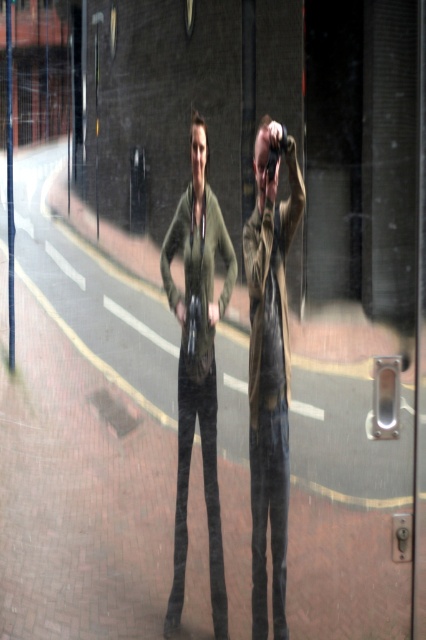
Question: Is leather jacket at center positioned at the back of olive green fabric jacket at center?

Choices:
 (A) no
 (B) yes

Answer: (B)

Question: Which point is farther from the camera taking this photo?

Choices:
 (A) (256, 232)
 (B) (213, 250)

Answer: (A)

Question: Does leather jacket at center appear over olive green fabric jacket at center?

Choices:
 (A) no
 (B) yes

Answer: (A)

Question: Can you confirm if leather jacket at center is thinner than olive green fabric jacket at center?

Choices:
 (A) no
 (B) yes

Answer: (B)